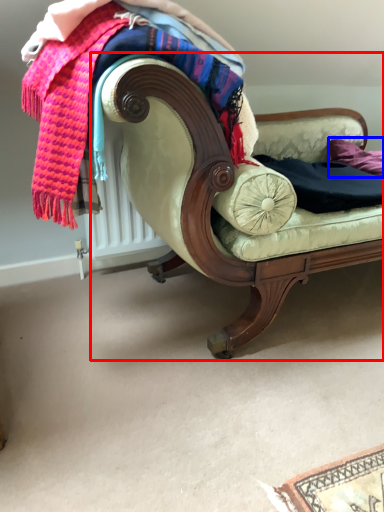
Question: Which object is closer to the camera taking this photo, studio couch (highlighted by a red box) or pillow (highlighted by a blue box)?

Choices:
 (A) studio couch
 (B) pillow

Answer: (A)